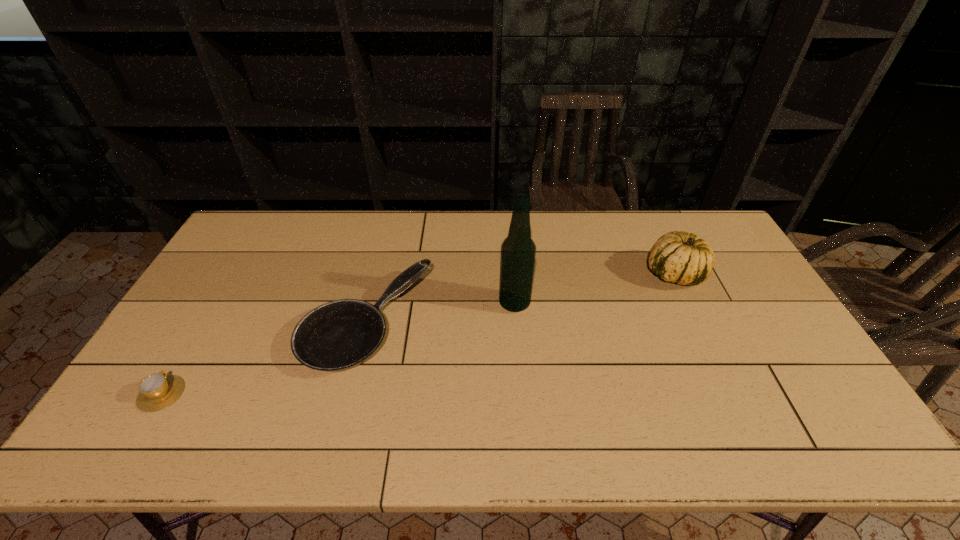
Where is `vacant area in the image that satisfies the following two spatial constraints: 1. with the handle on the side of the rightmost object; 2. on the right side of the leftmost object`? Image resolution: width=960 pixels, height=540 pixels. vacant area in the image that satisfies the following two spatial constraints: 1. with the handle on the side of the rightmost object; 2. on the right side of the leftmost object is located at coordinates (233, 274).

Where is `vacant space that satisfies the following two spatial constraints: 1. with the handle on the side of the shortest object; 2. on the left side of the rightmost object`? The image size is (960, 540). vacant space that satisfies the following two spatial constraints: 1. with the handle on the side of the shortest object; 2. on the left side of the rightmost object is located at coordinates (233, 274).

The height and width of the screenshot is (540, 960). What are the coordinates of `free region that satisfies the following two spatial constraints: 1. with the handle on the side of the leftmost object; 2. on the right side of the rightmost object` in the screenshot? It's located at (233, 274).

Identify the location of free location that satisfies the following two spatial constraints: 1. with the handle on the side of the alcohol; 2. on the left side of the shortest object. (x=216, y=303).

The height and width of the screenshot is (540, 960). Identify the location of vacant region that satisfies the following two spatial constraints: 1. with the handle on the side of the tallest object; 2. on the right side of the shortest object. (216, 303).